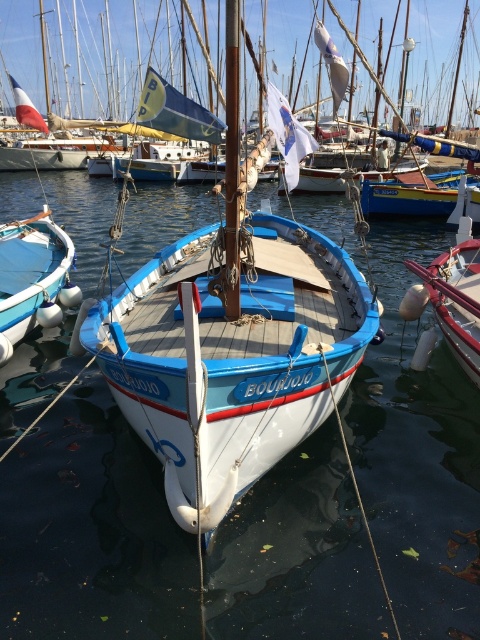
Please look at the image and locate the point at coordinates (x=92, y=531). What object is at that point?

The clear blue water at center is located at point (x=92, y=531).

You are standing at the edge of the marina and want to know which of the two points, point [109,182] or point [181,492], is closer to you. Can you determine this based on the scene?

Point [109,182] is closer to you than point [181,492] because it is further to the viewer in the scene.

You are an observer standing at the edge of the marina looking out. You see the clear blue water at center and the white matte boat at left. Which object appears taller in the scene?

The clear blue water at center appears taller than the white matte boat at left in the scene.